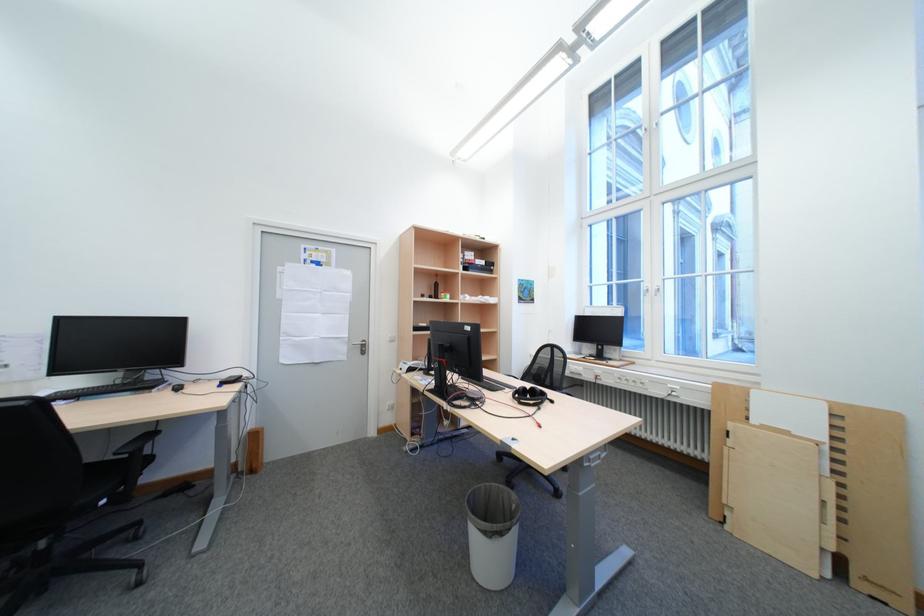
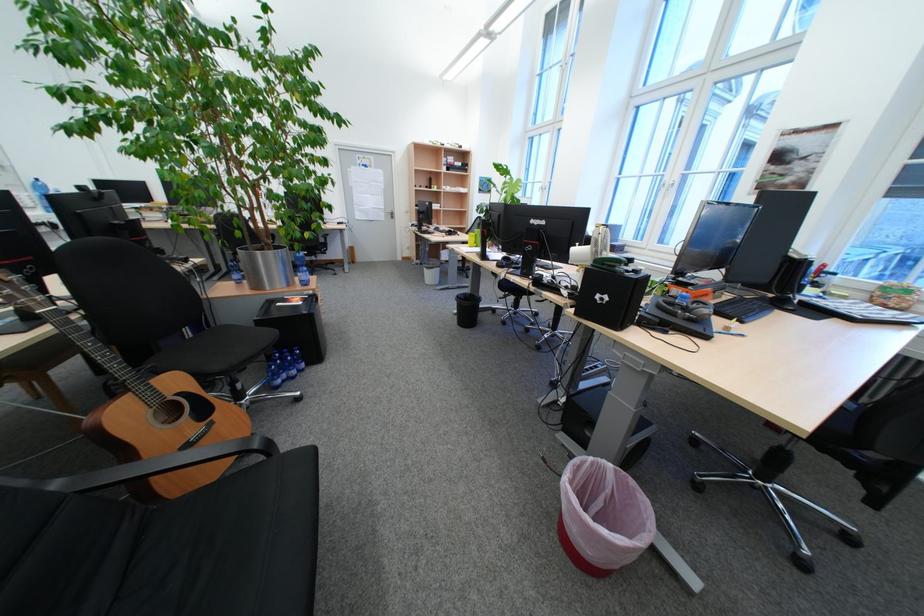
Which direction would the cameraman need to move to produce the second image?

The movement direction of the cameraman is right, backward.